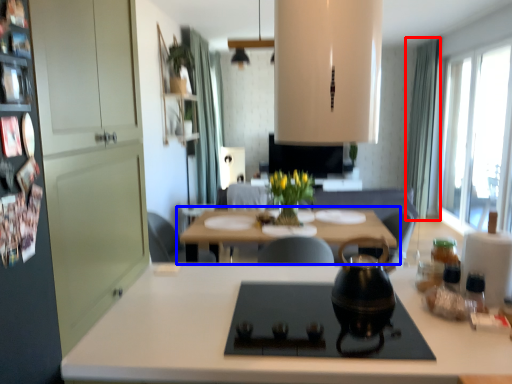
Question: Among these objects, which one is nearest to the camera, curtain (highlighted by a red box) or table (highlighted by a blue box)?

Choices:
 (A) curtain
 (B) table

Answer: (B)